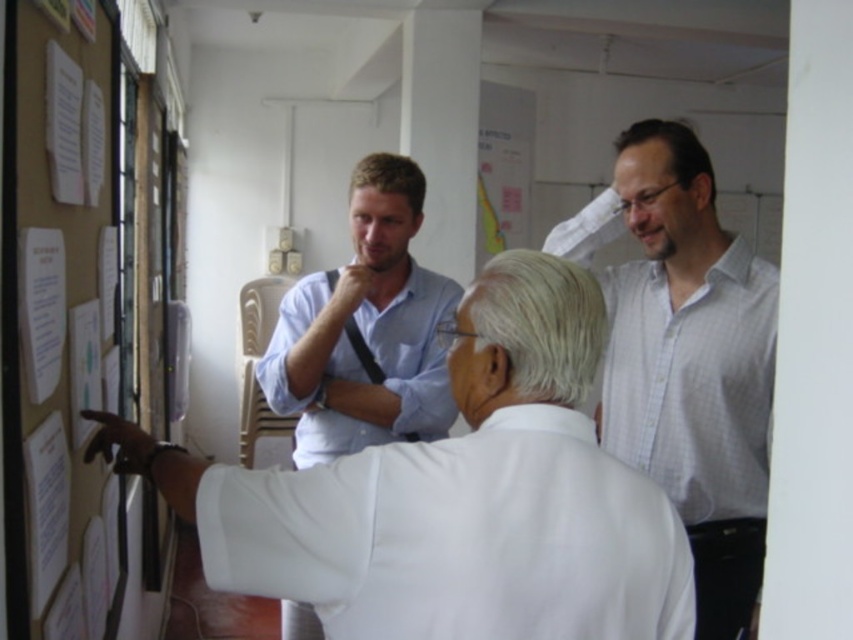
You are a photographer trying to capture a clear shot of both the light blue cotton shirt at center and the brown matte hair at center. Since you want both subjects to be fully visible in the frame, which object should you focus on first to ensure the taller one is in focus?

The light blue cotton shirt at center is taller than the brown matte hair at center, so you should focus on the light blue cotton shirt at center first to ensure it is in focus before adjusting for the other.

Looking at this image, you are standing in the room and want to hand a document to the person wearing the light blue cotton shirt at center. To do so, should you move towards the area above or below the brown matte hair at center?

The light blue cotton shirt at center is positioned under brown matte hair at center, so you should move towards the area below the brown matte hair at center to reach the light blue cotton shirt at center.

You are standing in the room and want to know the exact location of the light blue cotton shirt at center. What are its coordinates?

The light blue cotton shirt at center is located at coordinates point (376, 362).